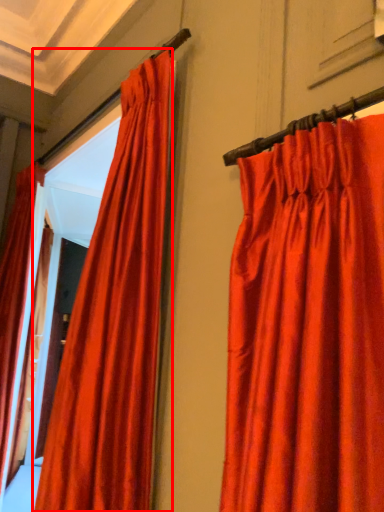
Question: From the image's perspective, where is curtain (annotated by the red box) located relative to curtain?

Choices:
 (A) above
 (B) below

Answer: (A)